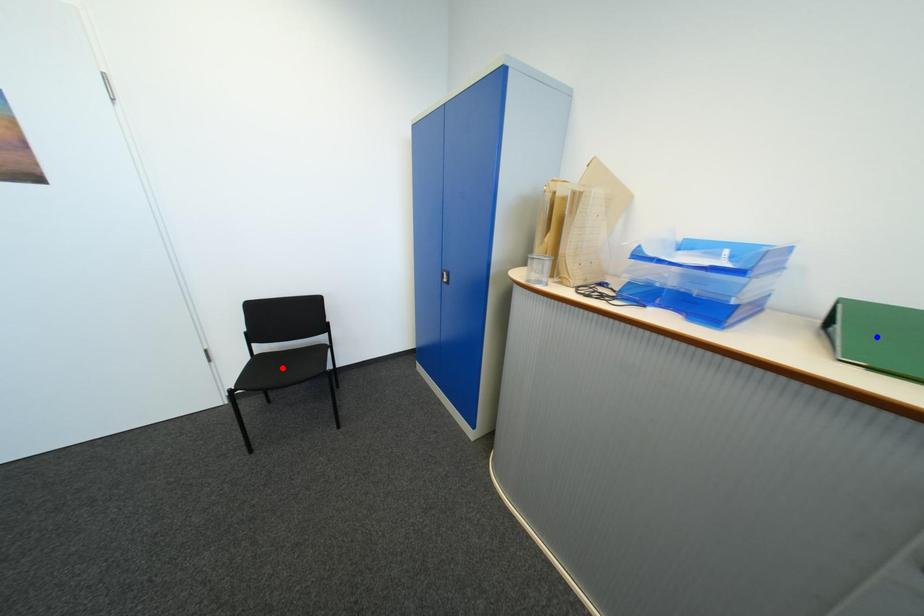
Question: Which of the two points in the image is closer to the camera?

Choices:
 (A) Blue point is closer.
 (B) Red point is closer.

Answer: (A)